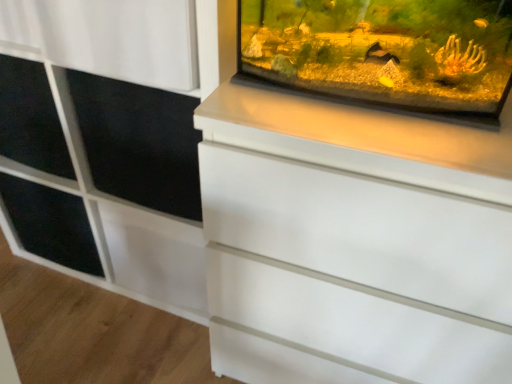
Question: Does black matte shelf at left have a greater height compared to white matte cabinet at upper right?

Choices:
 (A) yes
 (B) no

Answer: (B)

Question: Considering the relative sizes of black matte shelf at left and white matte cabinet at upper right in the image provided, is black matte shelf at left wider than white matte cabinet at upper right?

Choices:
 (A) no
 (B) yes

Answer: (A)

Question: Could you tell me if black matte shelf at left is facing white matte cabinet at upper right?

Choices:
 (A) no
 (B) yes

Answer: (B)

Question: Is black matte shelf at left thinner than white matte cabinet at upper right?

Choices:
 (A) yes
 (B) no

Answer: (A)

Question: Does black matte shelf at left come behind white matte cabinet at upper right?

Choices:
 (A) no
 (B) yes

Answer: (B)

Question: Is black matte shelf at left to the right of white matte cabinet at upper right from the viewer's perspective?

Choices:
 (A) yes
 (B) no

Answer: (B)

Question: From a real-world perspective, is transparent glass tank at upper right on top of white matte cabinet at upper right?

Choices:
 (A) no
 (B) yes

Answer: (B)

Question: Is transparent glass tank at upper right in front of white matte cabinet at upper right?

Choices:
 (A) yes
 (B) no

Answer: (A)

Question: Does transparent glass tank at upper right lie behind white matte cabinet at upper right?

Choices:
 (A) yes
 (B) no

Answer: (B)

Question: Does transparent glass tank at upper right have a lesser width compared to white matte cabinet at upper right?

Choices:
 (A) no
 (B) yes

Answer: (B)

Question: Can you see transparent glass tank at upper right touching white matte cabinet at upper right?

Choices:
 (A) yes
 (B) no

Answer: (B)

Question: Is transparent glass tank at upper right located outside white matte cabinet at upper right?

Choices:
 (A) no
 (B) yes

Answer: (B)

Question: Does black matte shelf at left appear on the right side of black matte screen door at upper left?

Choices:
 (A) yes
 (B) no

Answer: (B)